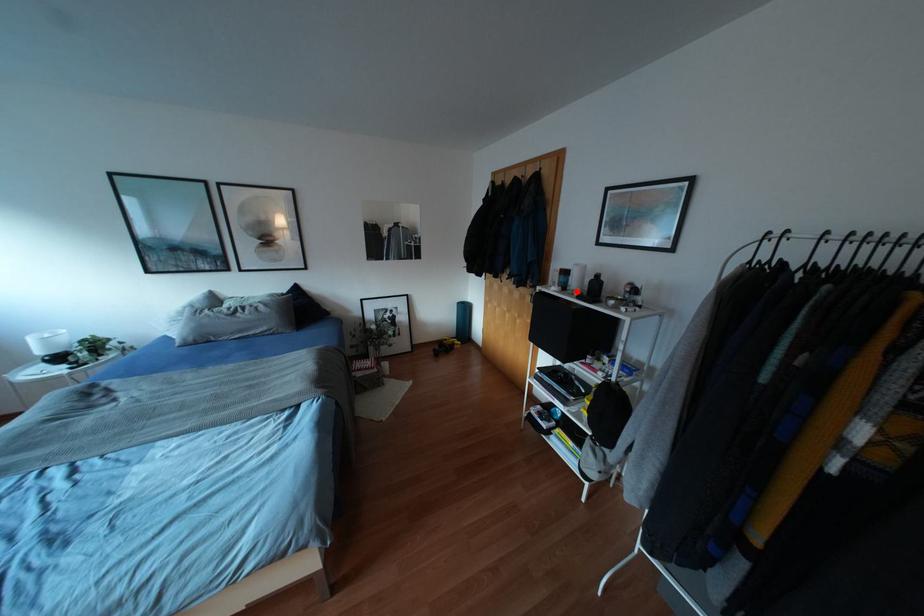
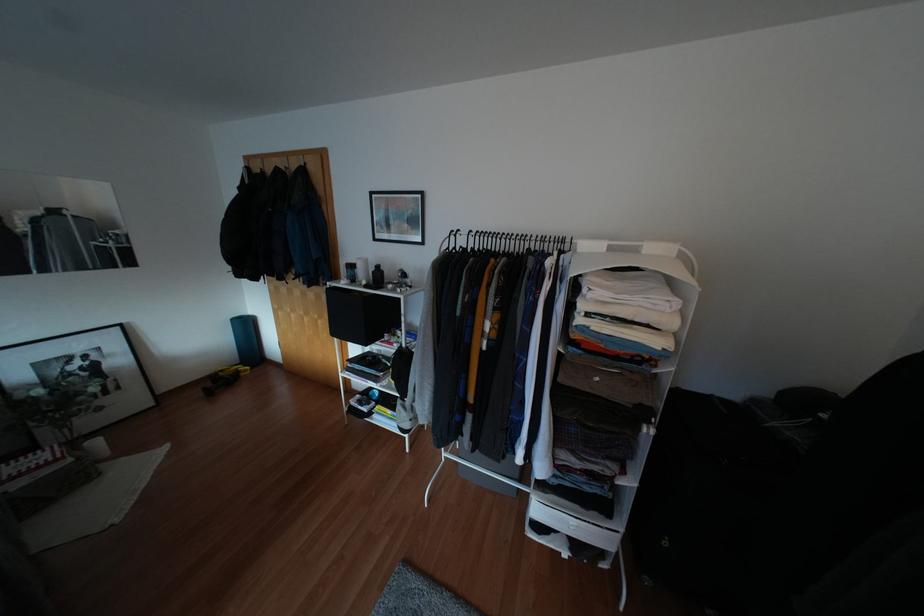
Find the pixel in the second image that matches the highlighted location in the first image.

(362, 282)